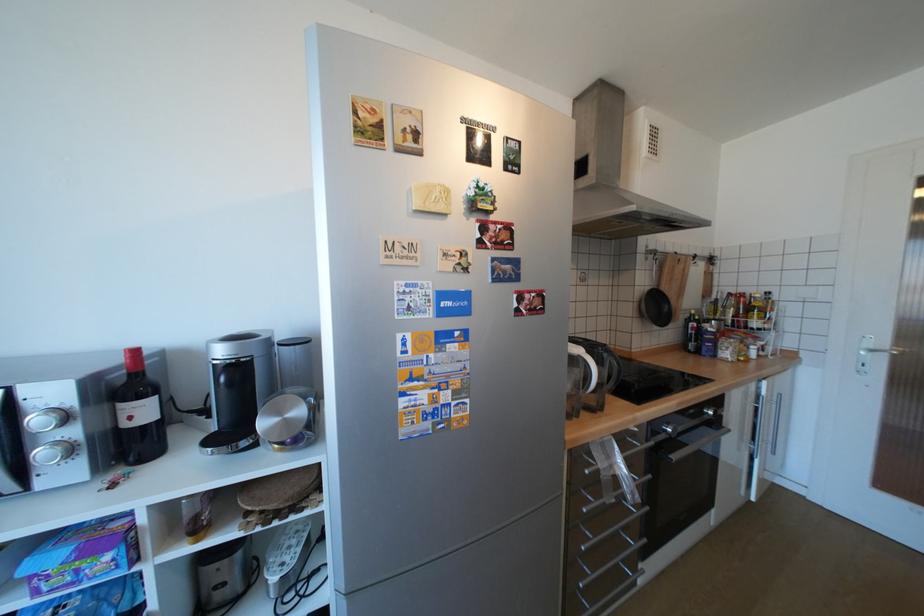
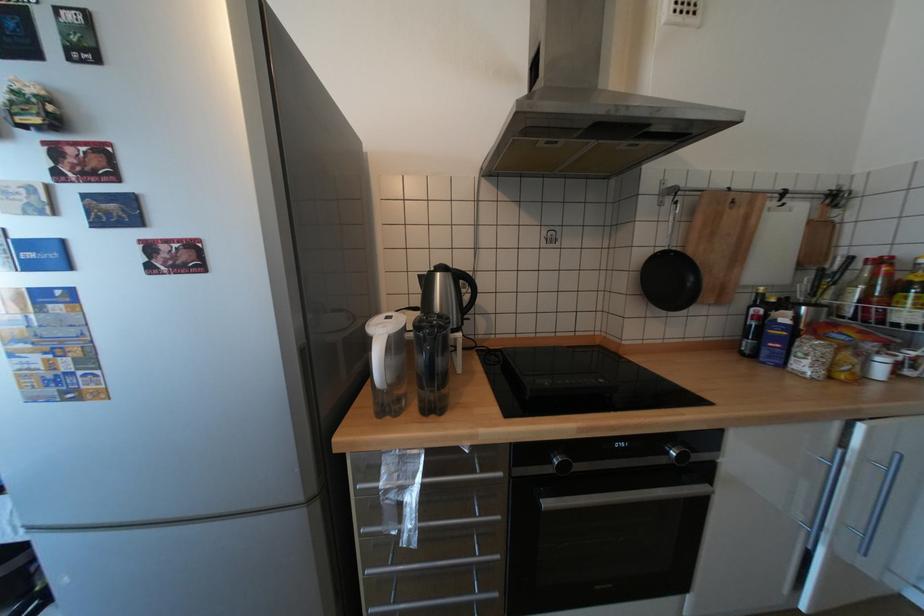
What movement of the cameraman would produce the second image?

The cameraman walked toward right, forward.